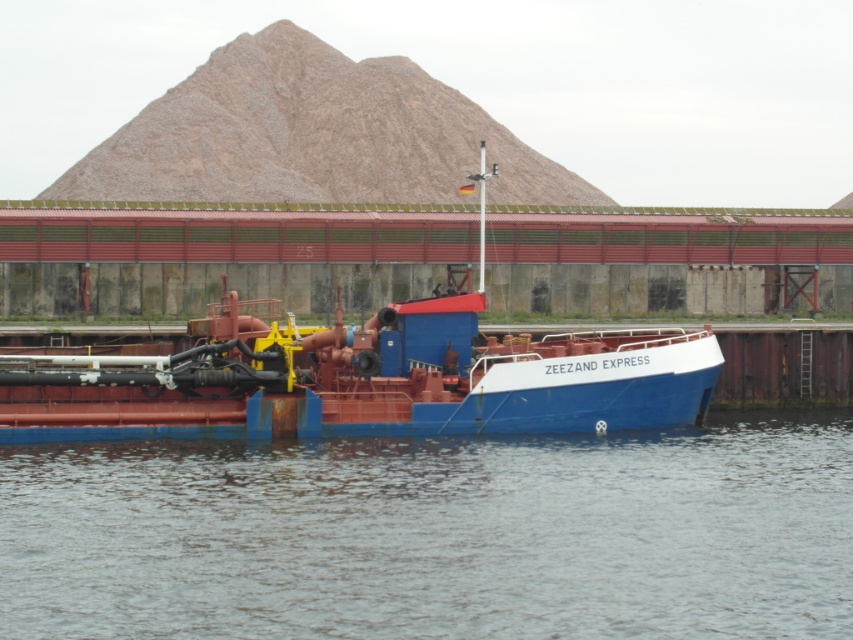
Question: Does transparent water at lower center appear on the left side of blue matte barge at center?

Choices:
 (A) no
 (B) yes

Answer: (A)

Question: Which of the following is the farthest from the observer?

Choices:
 (A) (123, 401)
 (B) (65, 477)

Answer: (A)

Question: Which of the following is the closest to the observer?

Choices:
 (A) (695, 554)
 (B) (260, 412)

Answer: (A)

Question: Does transparent water at lower center have a greater width compared to blue matte barge at center?

Choices:
 (A) yes
 (B) no

Answer: (B)

Question: Can you confirm if transparent water at lower center is positioned to the right of blue matte barge at center?

Choices:
 (A) yes
 (B) no

Answer: (A)